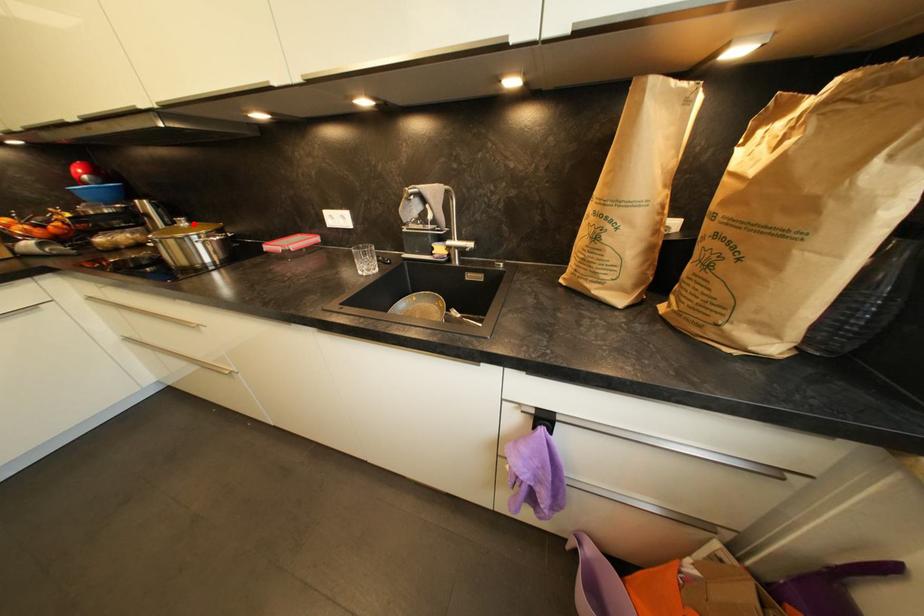
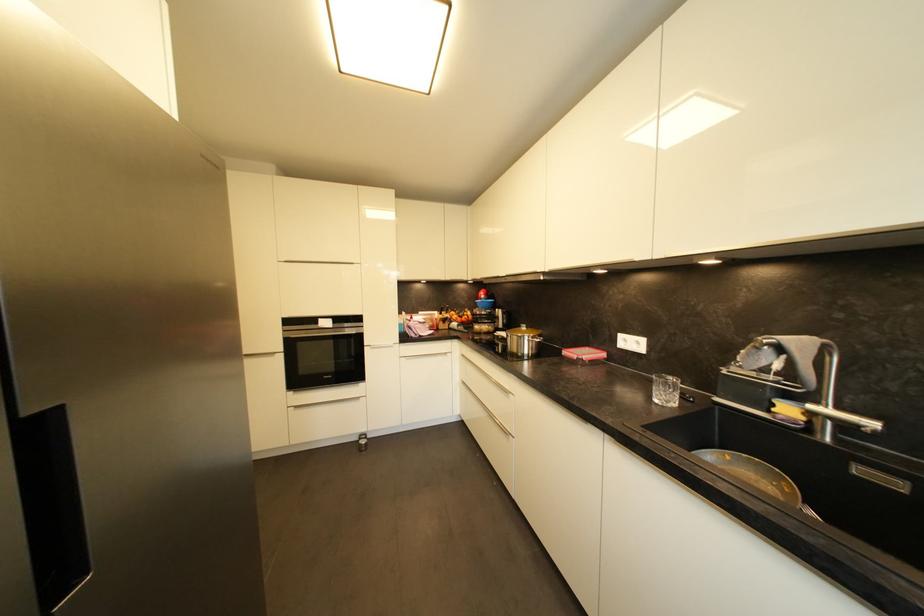
Locate, in the second image, the point that corresponds to the highlighted location in the first image.

(531, 330)